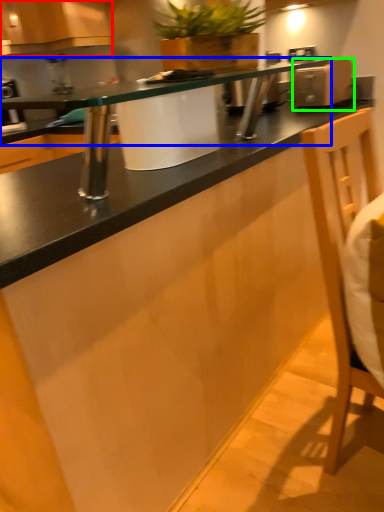
Question: Considering the real-world distances, which object is closest to cabinetry (highlighted by a red box)? countertop (highlighted by a blue box) or appliance (highlighted by a green box).

Choices:
 (A) countertop
 (B) appliance

Answer: (A)